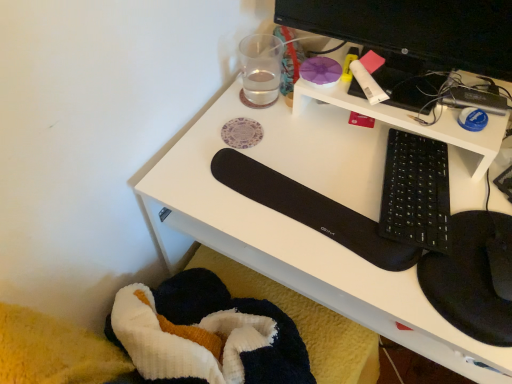
Question: From a real-world perspective, relative to white matte glue stick at upper right, positioned as the first stationery in right-to-left order, is black matte keyboard at center-right vertically above or below?

Choices:
 (A) above
 (B) below

Answer: (B)

Question: Is black matte keyboard at center-right inside the boundaries of white matte glue stick at upper right, positioned as the first stationery in right-to-left order, or outside?

Choices:
 (A) outside
 (B) inside

Answer: (A)

Question: Which of these objects is positioned farthest from the black glossy monitor at upper right?

Choices:
 (A) black matte keyboard at center-right
 (B) black matte keyboard at center-right
 (C) transparent glass at upper center, which is the 2th stationery from right to left
 (D) white matte glue stick at upper right, arranged as the second stationery when viewed from the left

Answer: (A)

Question: Which object is the farthest from the white matte glue stick at upper right, positioned as the first stationery in right-to-left order?

Choices:
 (A) black matte keyboard at center-right
 (B) black matte keyboard at center-right
 (C) black glossy monitor at upper right
 (D) transparent glass at upper center, the first stationery positioned from the left

Answer: (A)